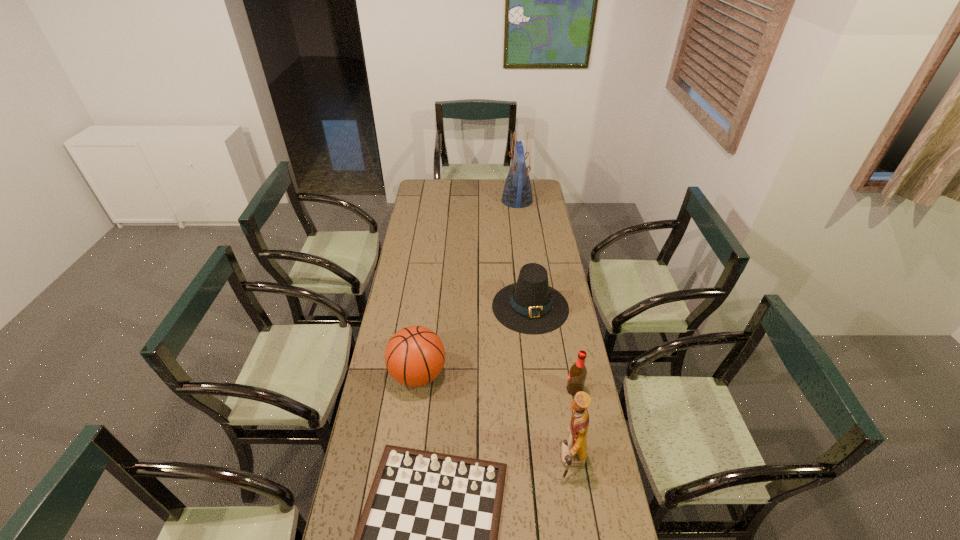
You are a GUI agent. You are given a task and a screenshot of the screen. Output one action in this format:
    pyautogui.click(x=<x>, y=<y>)
    Task: Click on the vacant position in the image that satisfies the following two spatial constraints: 1. on the front-facing side of the second farthest object; 2. on the right side of the beer bottle
    
    Given the screenshot: What is the action you would take?
    pyautogui.click(x=540, y=390)

Image resolution: width=960 pixels, height=540 pixels. I want to click on free space that satisfies the following two spatial constraints: 1. on the front-facing side of the beer bottle; 2. on the left side of the hat, so click(x=540, y=390).